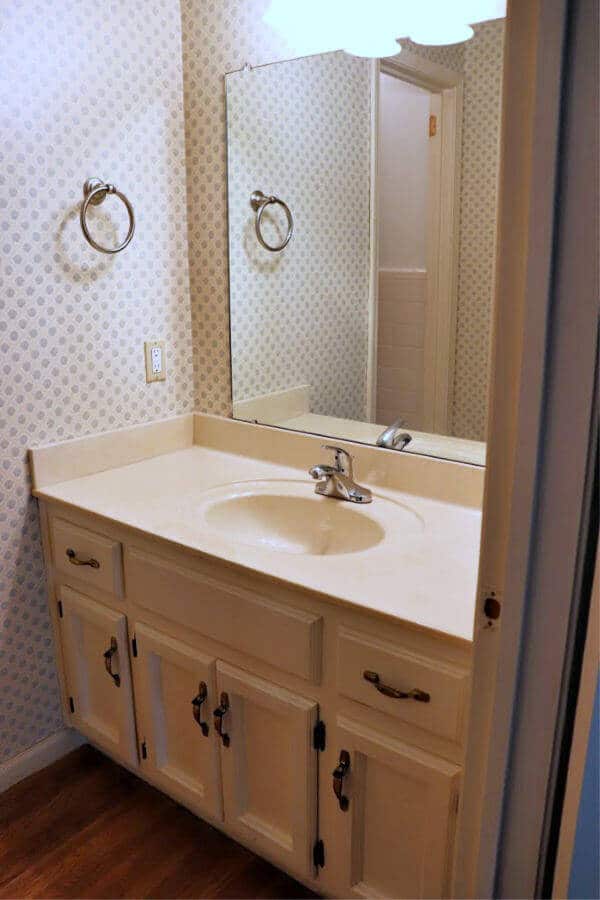
This screenshot has width=600, height=900. What are the coordinates of `silver tap` in the screenshot? It's located at (335, 479).